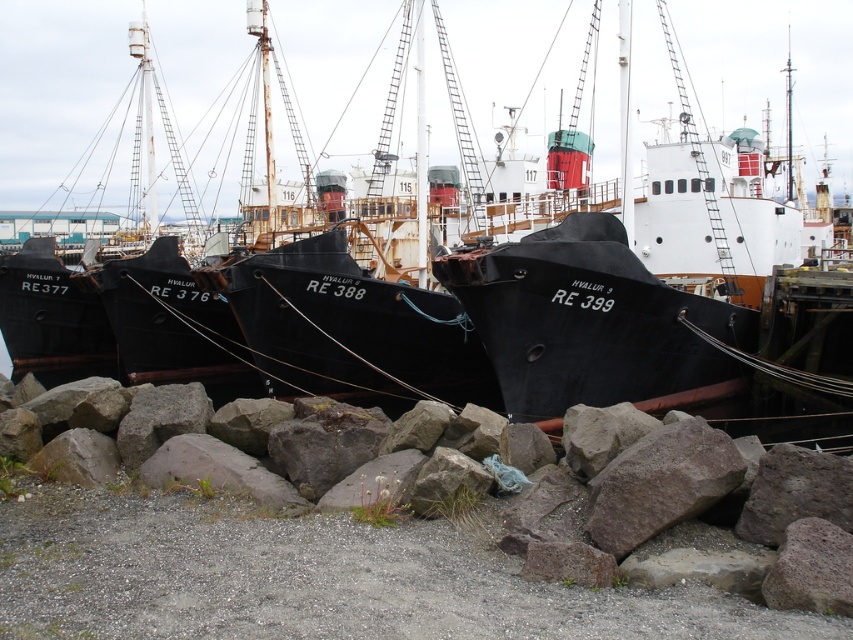
Is the position of black matte boat at center less distant than that of gray rough rock at lower center?

No, black matte boat at center is behind gray rough rock at lower center.

Can you confirm if black matte boat at center is positioned to the left of gray rough rock at lower center?

Yes, black matte boat at center is to the left of gray rough rock at lower center.

In order to click on black matte boat at center in this screenshot , I will do `click(775, 72)`.

This screenshot has height=640, width=853. Find the location of `black matte boat at center`. black matte boat at center is located at coordinates [x=775, y=72].